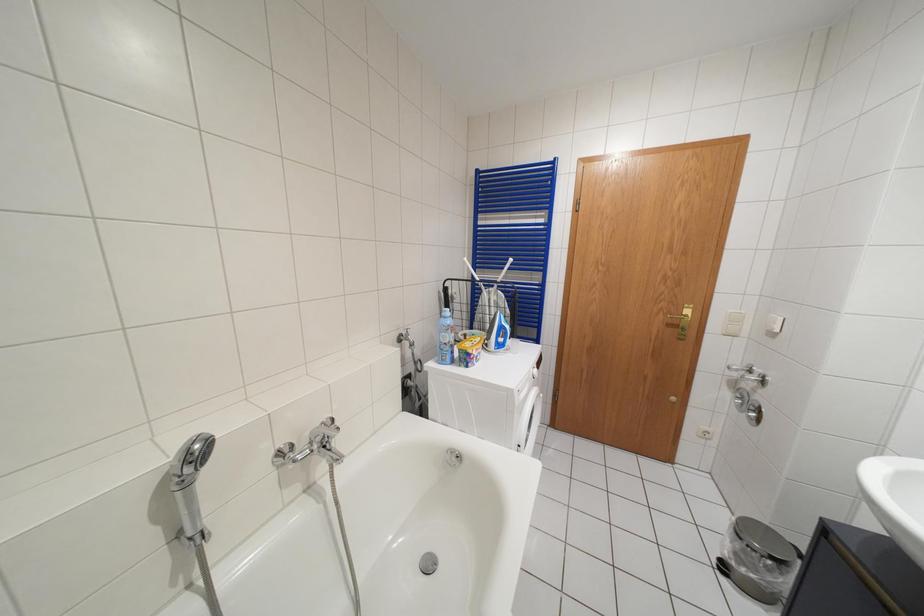
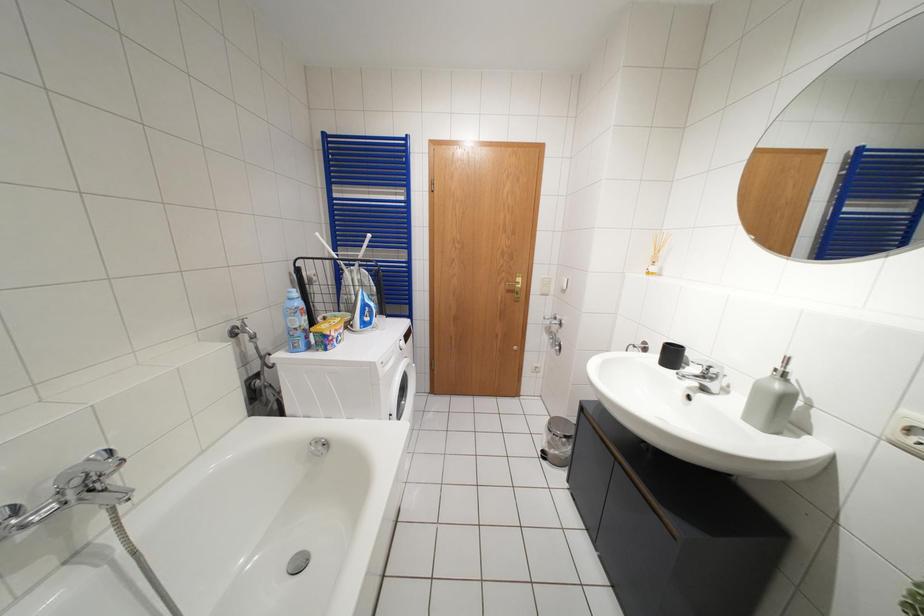
Question: The first image is from the beginning of the video and the second image is from the end. How did the camera likely rotate when shooting the video?

Choices:
 (A) Left
 (B) Right
 (C) Up
 (D) Down

Answer: (B)